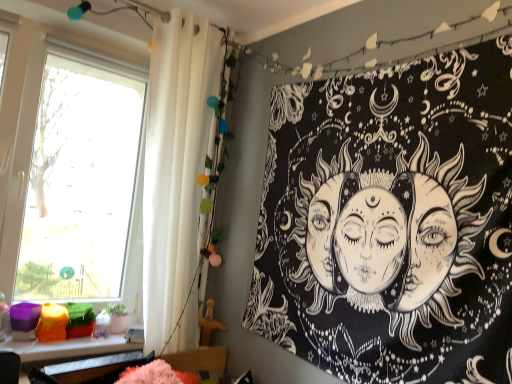
Question: Is transparent glass window at left not within white fabric shower curtain at left?

Choices:
 (A) yes
 (B) no

Answer: (A)

Question: Does transparent glass window at left touch white fabric shower curtain at left?

Choices:
 (A) no
 (B) yes

Answer: (A)

Question: Can white fabric shower curtain at left be found inside transparent glass window at left?

Choices:
 (A) no
 (B) yes

Answer: (A)

Question: Is transparent glass window at left to the right of white fabric shower curtain at left from the viewer's perspective?

Choices:
 (A) yes
 (B) no

Answer: (B)

Question: Considering the relative positions of transparent glass window at left and white fabric shower curtain at left in the image provided, is transparent glass window at left to the left of white fabric shower curtain at left from the viewer's perspective?

Choices:
 (A) no
 (B) yes

Answer: (B)

Question: Is transparent glass window at left facing away from white fabric shower curtain at left?

Choices:
 (A) yes
 (B) no

Answer: (B)

Question: Does plastic colorful objects at lower left have a greater width compared to transparent glass window at left?

Choices:
 (A) no
 (B) yes

Answer: (B)

Question: From the image's perspective, is plastic colorful objects at lower left under transparent glass window at left?

Choices:
 (A) no
 (B) yes

Answer: (B)

Question: Does plastic colorful objects at lower left have a lesser height compared to transparent glass window at left?

Choices:
 (A) yes
 (B) no

Answer: (A)

Question: From a real-world perspective, is plastic colorful objects at lower left under transparent glass window at left?

Choices:
 (A) no
 (B) yes

Answer: (B)

Question: Is plastic colorful objects at lower left bigger than transparent glass window at left?

Choices:
 (A) yes
 (B) no

Answer: (B)

Question: Is plastic colorful objects at lower left located outside transparent glass window at left?

Choices:
 (A) no
 (B) yes

Answer: (B)

Question: Is plastic colorful objects at lower left completely or partially outside of white fabric shower curtain at left?

Choices:
 (A) yes
 (B) no

Answer: (A)